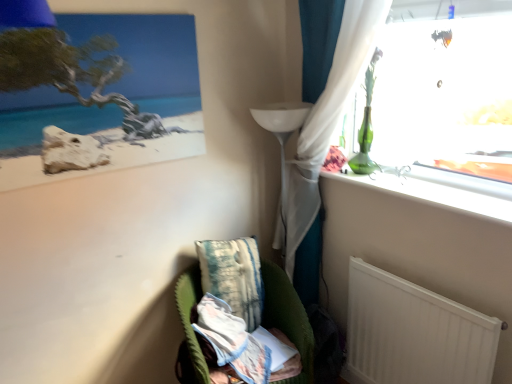
Question: Is white matte radiator at lower right not near textured teal pillow at lower center?

Choices:
 (A) yes
 (B) no

Answer: (B)

Question: Is white matte radiator at lower right directly adjacent to textured teal pillow at lower center?

Choices:
 (A) no
 (B) yes

Answer: (A)

Question: Does white matte radiator at lower right appear on the left side of textured teal pillow at lower center?

Choices:
 (A) no
 (B) yes

Answer: (A)

Question: From the image's perspective, is white matte radiator at lower right located beneath textured teal pillow at lower center?

Choices:
 (A) yes
 (B) no

Answer: (A)

Question: Does white matte radiator at lower right have a smaller size compared to textured teal pillow at lower center?

Choices:
 (A) no
 (B) yes

Answer: (B)

Question: Considering the relative positions of white matte radiator at lower right and textured teal pillow at lower center in the image provided, is white matte radiator at lower right to the left or to the right of textured teal pillow at lower center?

Choices:
 (A) left
 (B) right

Answer: (B)

Question: Is white matte radiator at lower right situated inside textured teal pillow at lower center or outside?

Choices:
 (A) outside
 (B) inside

Answer: (A)

Question: Considering the positions of point (348, 344) and point (239, 314), is point (348, 344) closer or farther from the camera than point (239, 314)?

Choices:
 (A) closer
 (B) farther

Answer: (B)

Question: Considering the positions of white matte radiator at lower right and textured teal pillow at lower center in the image, is white matte radiator at lower right wider or thinner than textured teal pillow at lower center?

Choices:
 (A) thin
 (B) wide

Answer: (A)

Question: From the image's perspective, is velvet green armchair at lower center positioned above or below white matte radiator at lower right?

Choices:
 (A) below
 (B) above

Answer: (A)

Question: In terms of width, does velvet green armchair at lower center look wider or thinner when compared to white matte radiator at lower right?

Choices:
 (A) wide
 (B) thin

Answer: (A)

Question: Visually, is velvet green armchair at lower center positioned to the left or to the right of white matte radiator at lower right?

Choices:
 (A) left
 (B) right

Answer: (A)

Question: In the image, is velvet green armchair at lower center positioned in front of or behind white matte radiator at lower right?

Choices:
 (A) front
 (B) behind

Answer: (B)

Question: Which is correct: velvet green armchair at lower center is inside textured teal pillow at lower center, or outside of it?

Choices:
 (A) outside
 (B) inside

Answer: (A)

Question: From the image's perspective, is velvet green armchair at lower center located above or below textured teal pillow at lower center?

Choices:
 (A) below
 (B) above

Answer: (A)